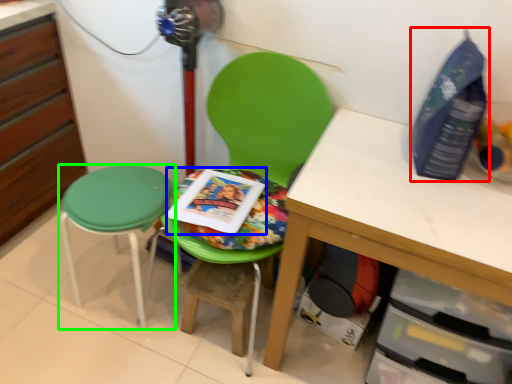
Question: Based on their relative distances, which object is nearer to bottle (highlighted by a red box)? Choose from paperback book (highlighted by a blue box) and stool (highlighted by a green box).

Choices:
 (A) paperback book
 (B) stool

Answer: (A)